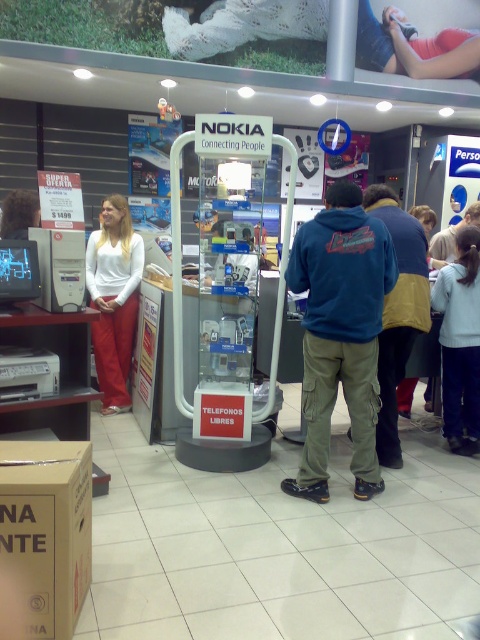
Question: Is brown cardboard box at lower left closer to the viewer compared to matte white blouse at center?

Choices:
 (A) yes
 (B) no

Answer: (A)

Question: Considering the relative positions of brown cardboard box at lower left and matte white blouse at center in the image provided, where is brown cardboard box at lower left located with respect to matte white blouse at center?

Choices:
 (A) below
 (B) above

Answer: (A)

Question: Which object is closer to the camera taking this photo?

Choices:
 (A) matte white blouse at center
 (B) brown cardboard box at lower left

Answer: (B)

Question: Can you confirm if brown cardboard box at lower left is smaller than matte white blouse at center?

Choices:
 (A) no
 (B) yes

Answer: (B)

Question: Which object is farther from the camera taking this photo?

Choices:
 (A) matte white blouse at center
 (B) brown cardboard box at lower left

Answer: (A)

Question: Which point is farther from the camera taking this photo?

Choices:
 (A) (76, 588)
 (B) (105, 212)

Answer: (B)